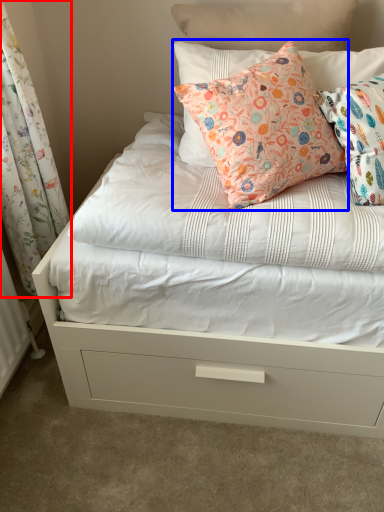
Question: Which object is further to the camera taking this photo, curtain (highlighted by a red box) or pillow (highlighted by a blue box)?

Choices:
 (A) curtain
 (B) pillow

Answer: (B)